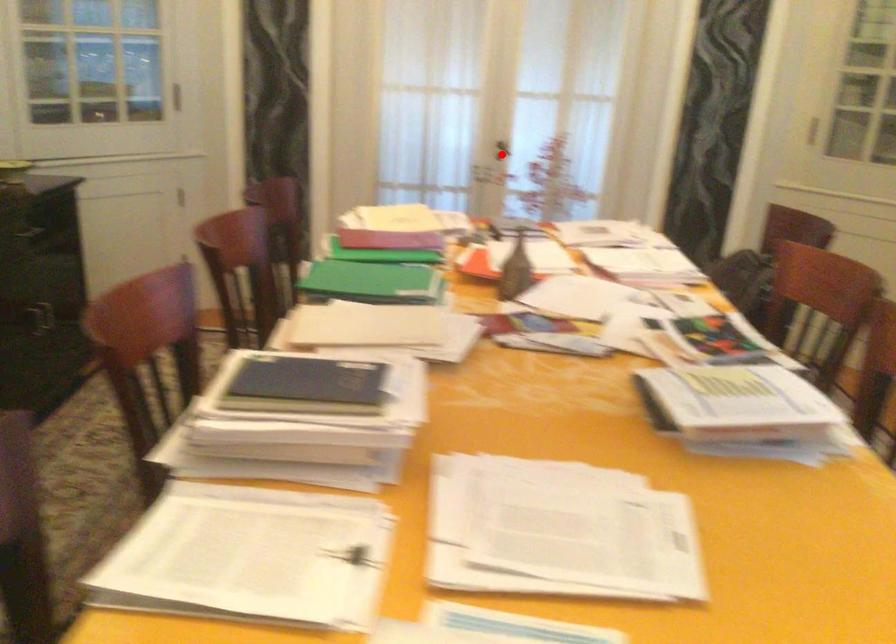
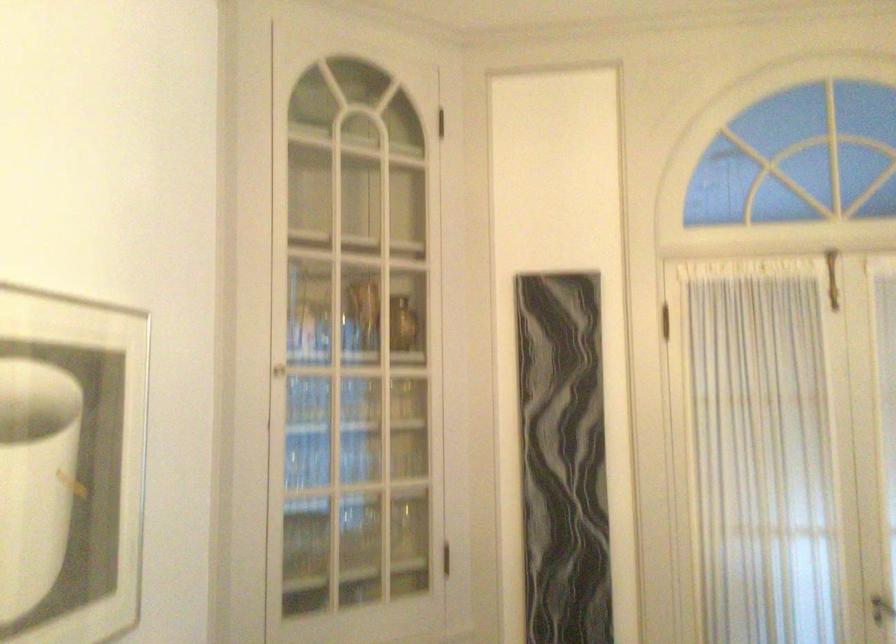
Question: I am providing you with two images of the same scene from different viewpoints. Given a red point in image1, look at the same physical point in image2. Is it:

Choices:
 (A) Closer to the viewpoint
 (B) Farther from the viewpoint

Answer: (A)